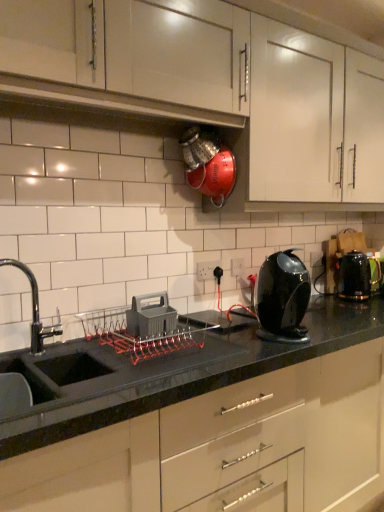
At what (x,y) coordinates should I click in order to perform the action: click on free space to the left of glossy black kettle at center-right. Please return your answer as a coordinate pair (x, y). Looking at the image, I should click on (224, 339).